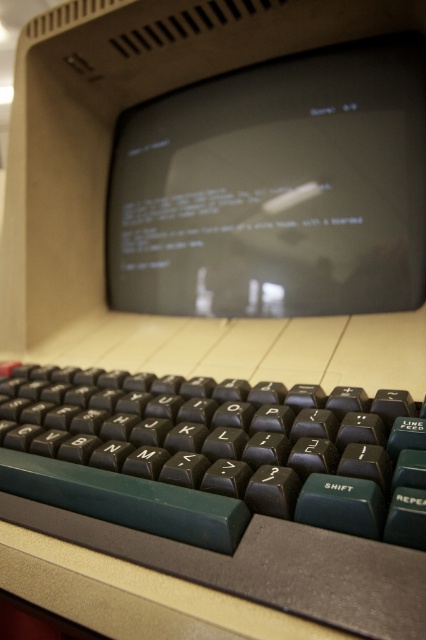
You are setting up a desk and want to place the black plastic keyboard at lower center and the matte black monitor at center. Given their widths, which object should you place first to ensure they fit properly on the desk?

The black plastic keyboard at lower center has a lesser width compared to the matte black monitor at center. Therefore, you should place the matte black monitor at center first, as it is wider, to ensure proper placement and avoid overcrowding the desk.

From the picture: You are setting up an old computer desk and need to place the black plastic keyboard at lower center and the matte black monitor at center. According to the image, where should you position the keyboard relative to the monitor?

The black plastic keyboard at lower center should be positioned below the matte black monitor at center as per the image.

You are setting up a desk and want to place the black plastic keyboard at lower center and the matte black monitor at center on the desk. Given that the desk has limited space, which object should you place first to ensure both fit on the desk?

The black plastic keyboard at lower center has a smaller size compared to the matte black monitor at center, so you should place the matte black monitor at center first to ensure both fit on the desk.